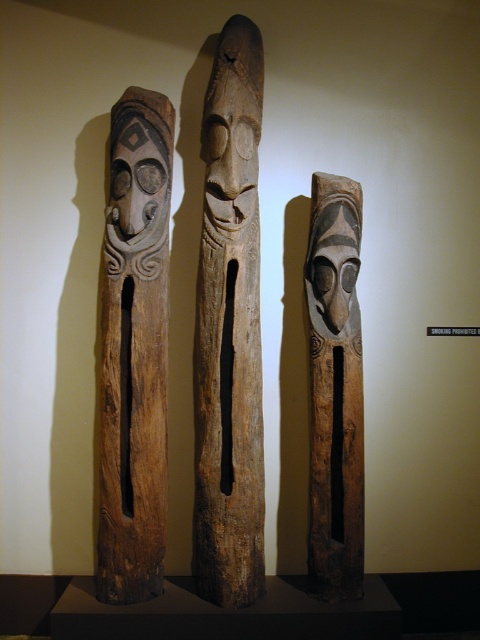
Question: Which point is farther to the camera?

Choices:
 (A) natural wood totem pole at center
 (B) brown wood carving at left

Answer: (A)

Question: Which point appears closest to the camera in this image?

Choices:
 (A) (215, 51)
 (B) (156, 396)
 (C) (311, 284)

Answer: (B)

Question: From the image, what is the correct spatial relationship of natural wood totem pole at center in relation to brown wood carving at left?

Choices:
 (A) above
 (B) below

Answer: (A)

Question: Which point is farther to the camera?

Choices:
 (A) natural wood totem pole at center
 (B) natural wood mask at center

Answer: (B)

Question: Where is natural wood totem pole at center located in relation to brown wood carving at left in the image?

Choices:
 (A) below
 (B) above

Answer: (B)

Question: Is natural wood totem pole at center to the left of brown wood carving at left from the viewer's perspective?

Choices:
 (A) no
 (B) yes

Answer: (A)